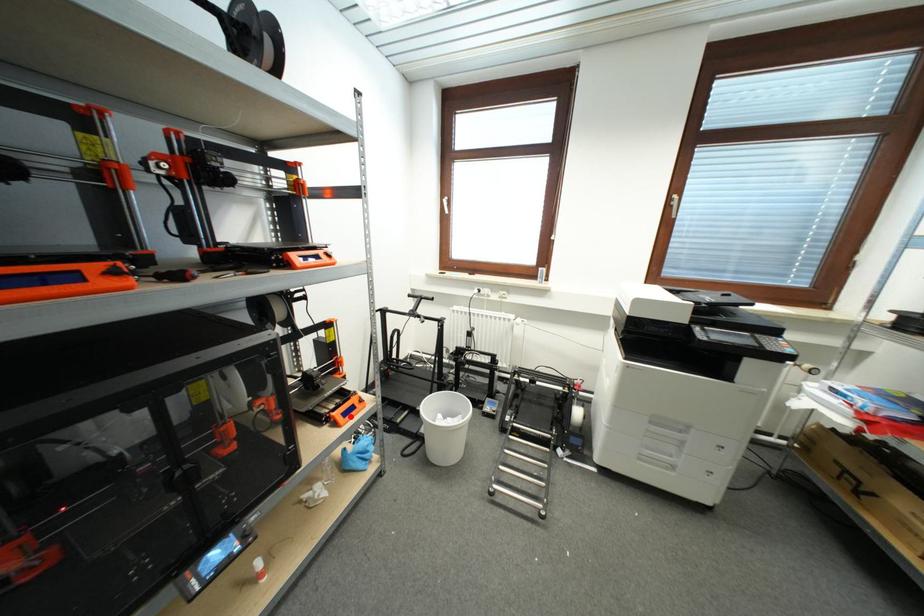
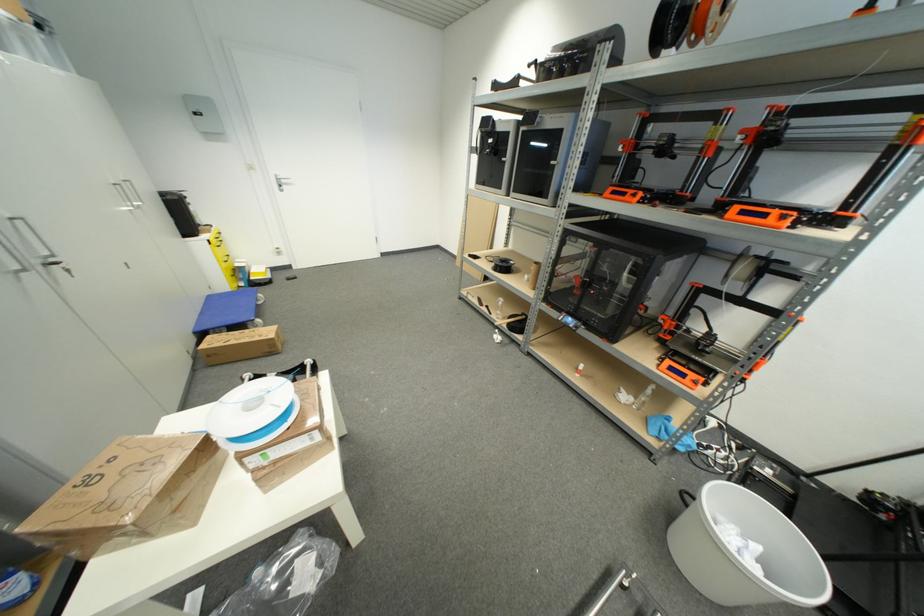
Find the pixel in the second image that matches the highlighted location in the first image.

(675, 371)